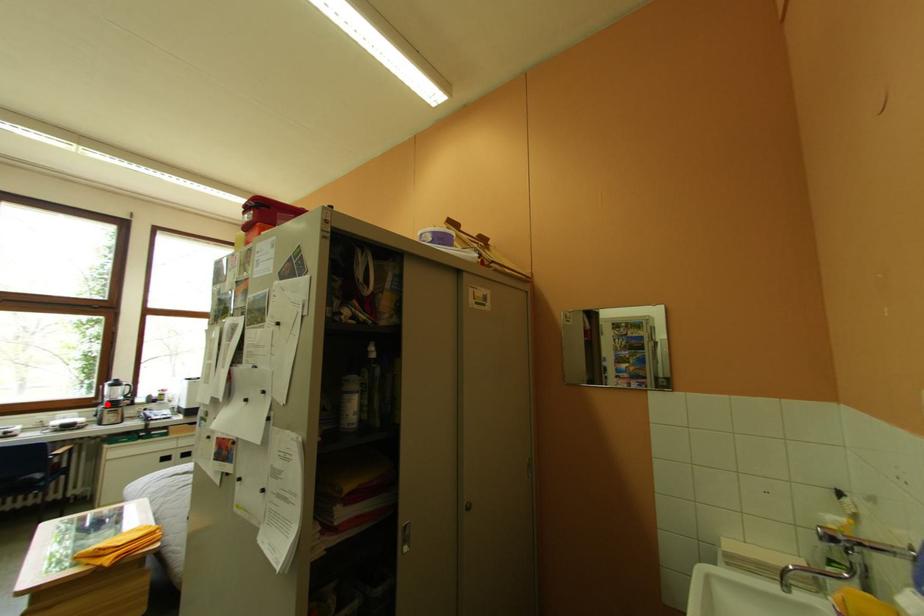
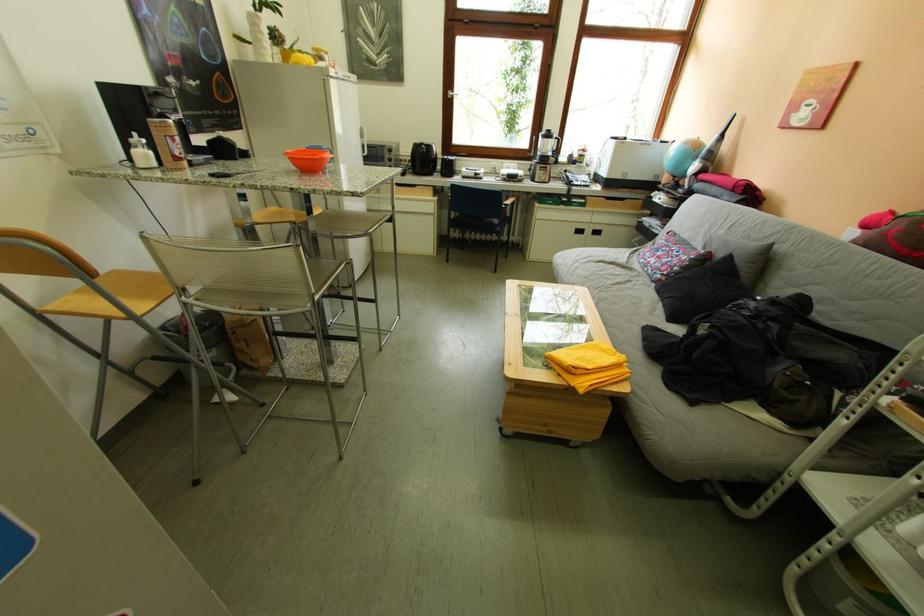
Question: I am providing you with two images of the same scene from different viewpoints. Given a red point in image1, look at the same physical point in image2. Is it:

Choices:
 (A) Closer to the viewpoint
 (B) Farther from the viewpoint

Answer: (A)